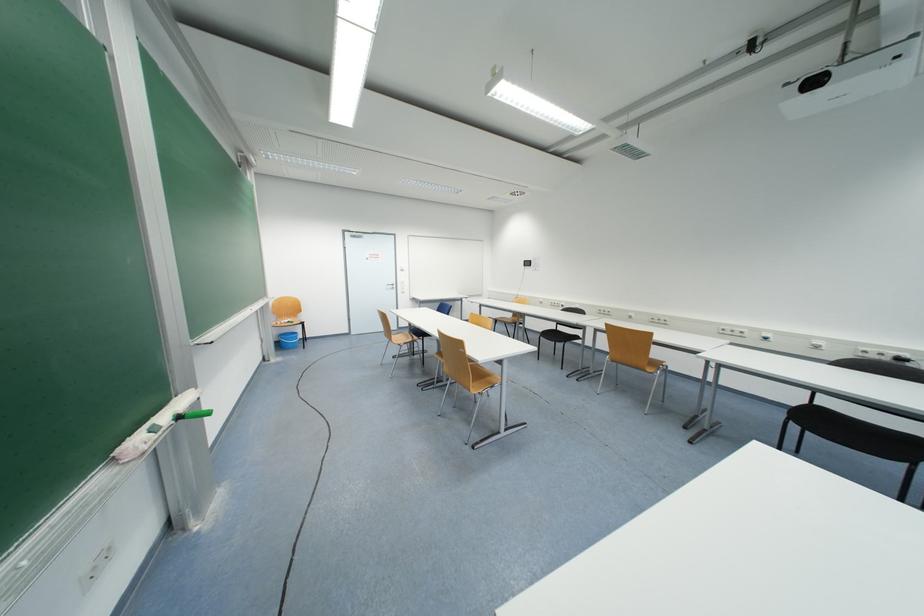
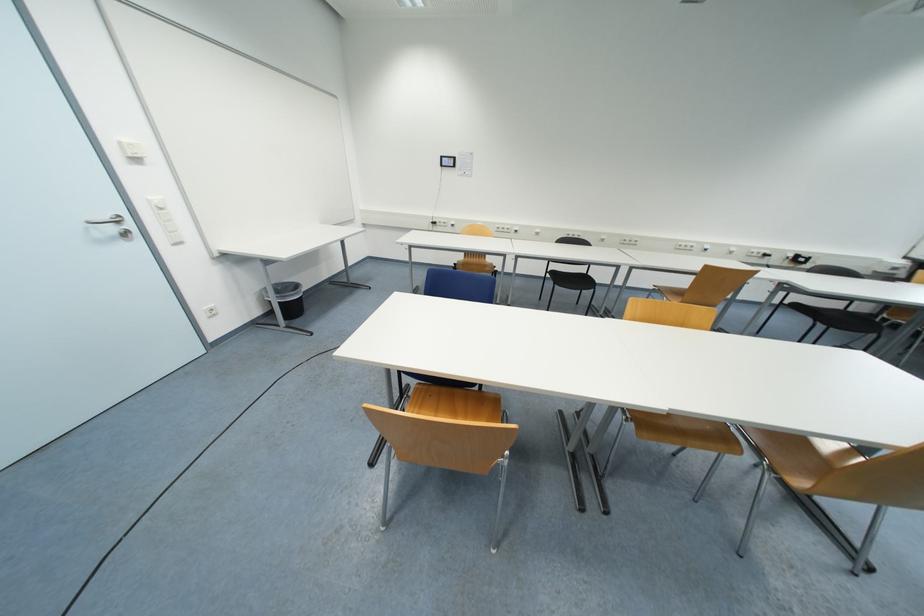
Where in the second image is the point corresponding to (395,288) from the first image?

(117, 230)